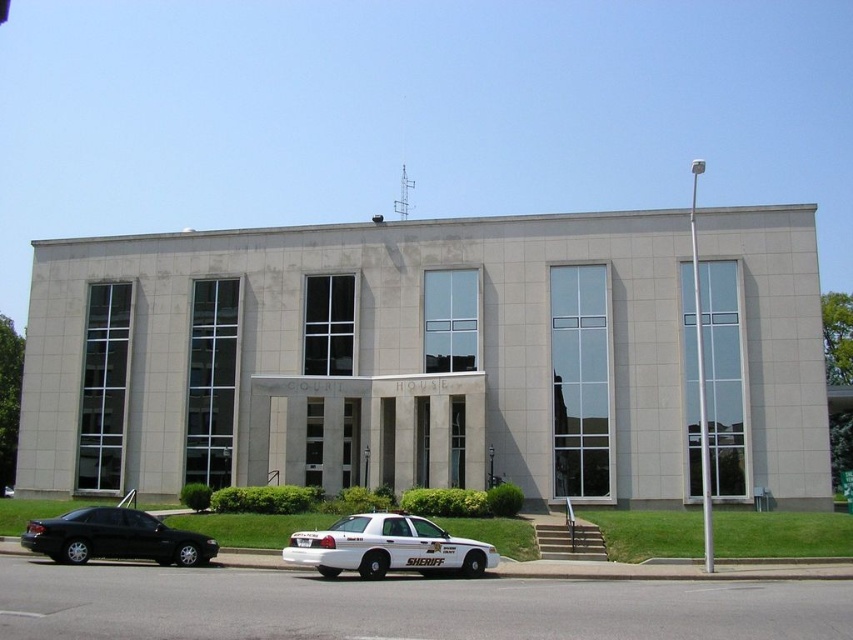
You are standing at the entrance of the courthouse. You see a point marked at coordinates (387, 547). What object is located at that point?

The point at coordinates (387, 547) indicates a white glossy police car at center.

You are a photographer planning to take a picture of the courthouse. You have a white glossy police car at center and a matte black sedan at lower left in your shot. Which vehicle should you focus on if you want to capture the one that is shorter in height?

The white glossy police car at center has a lesser height compared to the matte black sedan at lower left, so you should focus on the white glossy police car at center to capture the shorter vehicle.

You are a pedestrian standing at the entrance of the courthouse. You need to cross the street to reach the bus stop located behind the matte black sedan at lower left. The road is 12 meters wide. Can you safely cross the road before the white glossy police car at center arrives? Assume the police car is moving at 20 km per hour and you walk at 1.5 m per second.

The distance between the white glossy police car at center and the matte black sedan at lower left is 10.34 meters. Since the road is 12 meters wide and the police car is 10.34 meters away from the sedan, the pedestrian can safely cross the road before the police car arrives. The pedestrian takes 8 seconds to cross 12 meters at 1.5 m per second, while the police car would take approximately 18.5 seconds to cover the 10.34 meters at 20 km per hour. Therefore, the pedestrian has enough time.